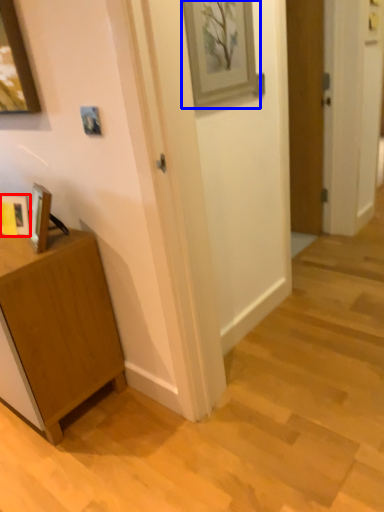
Question: Among these objects, which one is farthest to the camera, picture frame (highlighted by a red box) or picture frame (highlighted by a blue box)?

Choices:
 (A) picture frame
 (B) picture frame

Answer: (A)